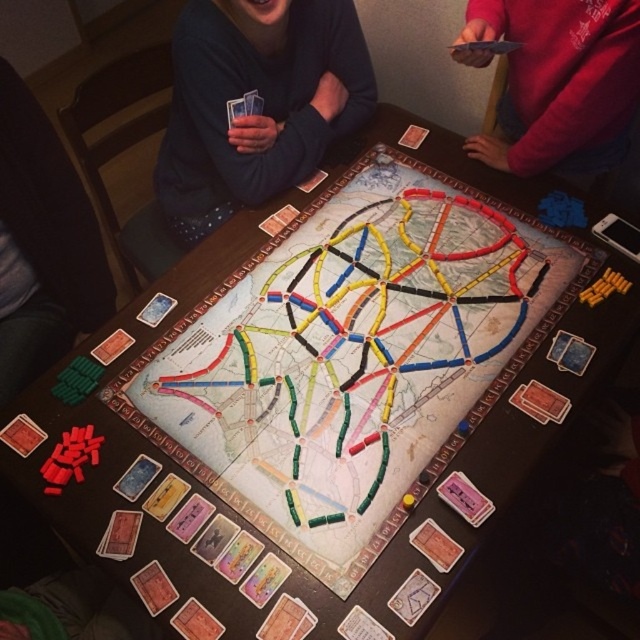
You are a player sitting at the edge of the table where the game is set up. You need to place a new game piece on the dark blue sweater at upper center. According to the coordinates provided, where exactly should you place the piece?

The dark blue sweater at upper center is located at point (262, 102), so you should place the new game piece at those coordinates.

You are a player sitting at the table and notice two players wearing dark blue sweater at upper center and red sweater at upper right. Which player is sitting closer to the game board?

The dark blue sweater at upper center is located below the red sweater at upper right, so the player wearing the dark blue sweater at upper center is sitting closer to the game board.

You are a player in the game and want to place a train piece on the board. You have a train piece in your hand and are looking at the two points on the map labeled as point 1 and point 2. Point 1 is at coordinate point (307,100) and point 2 is at coordinate point (492,10). Which point is closer to you so you can place your train piece more easily?

Point 1 at coordinate point (307,100) is closer to you than point 2 at coordinate point (492,10) because it is further to the camera, meaning it is positioned in a part of the board that is nearer to your viewpoint. Therefore, placing the train piece on point 1 would be easier as it is closer.